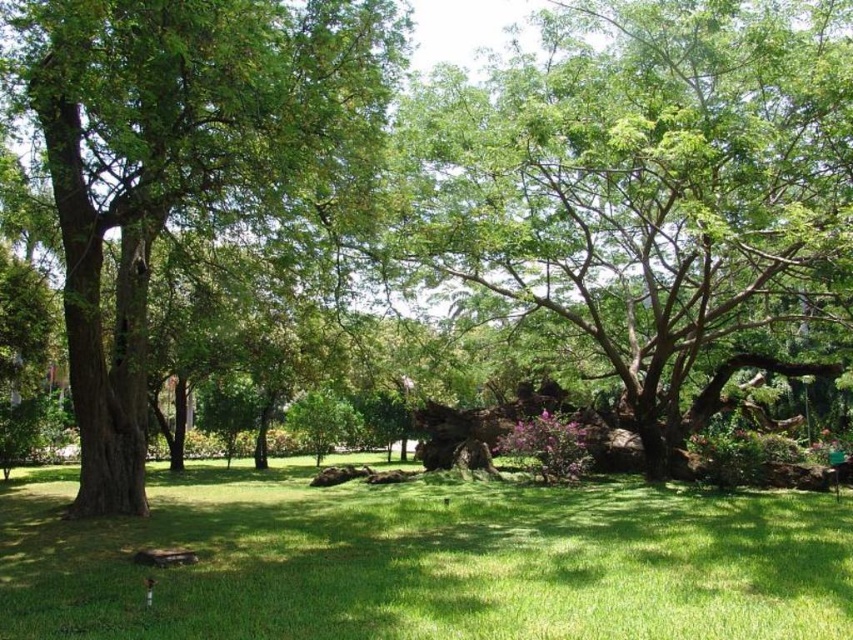
In order to click on green leafy tree at center in this screenshot , I will do `click(648, 186)`.

Who is more distant from viewer, (688,72) or (352,611)?

The point (688,72) is behind.

Can you confirm if green leafy tree at center is positioned above green grassy at center?

Correct, green leafy tree at center is located above green grassy at center.

The height and width of the screenshot is (640, 853). Describe the element at coordinates (648, 186) in the screenshot. I see `green leafy tree at center` at that location.

The image size is (853, 640). In order to click on green leafy tree at center in this screenshot , I will do `click(648, 186)`.

Does green grassy at center have a smaller size compared to green leafy tree at left?

Actually, green grassy at center might be larger than green leafy tree at left.

Who is lower down, green grassy at center or green leafy tree at left?

green grassy at center is lower down.

Where is `green grassy at center`? The image size is (853, 640). green grassy at center is located at coordinates (425, 561).